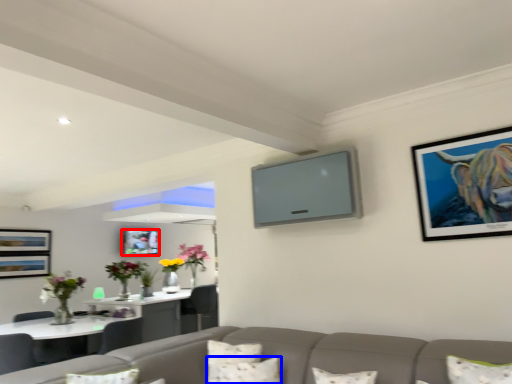
Question: Among these objects, which one is nearest to the camera, picture frame (highlighted by a red box) or pillow (highlighted by a blue box)?

Choices:
 (A) picture frame
 (B) pillow

Answer: (B)